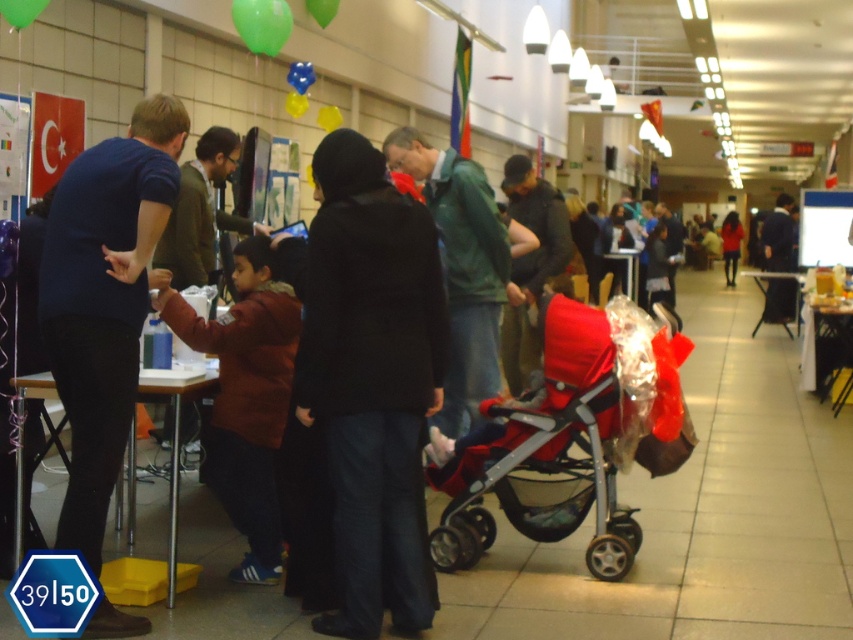
You are standing at the entrance of the hall and want to reach the green matte balloon at upper center. There is a green matte jacket at center blocking your path. Can you walk around the jacket without getting closer than 2 meters to it?

The green matte jacket at center is 5.41 meters away from the green matte balloon at upper center. Since the jacket is blocking the path, you can walk around it while maintaining a distance of at least 2 meters because the total distance allows for a detour without getting too close.

You are at a community fair and see two jackets displayed at the center of a stall. The jackets are labeled as the brown fuzzy jacket at center and the dark blue jacket at center. Which jacket is smaller in size?

The brown fuzzy jacket at center is smaller in size compared to the dark blue jacket at center.

You are a photographer standing at the camera position. You need to capture a photo of the black matte coat at center. Can you clearly see the coat from your current position without moving? Explain why or why not.

The black matte coat at center and camera are 4.09 meters apart from each other. Since the distance is relatively large, the photographer might need to adjust the camera settings or move closer to ensure the coat is clearly visible in the photo.